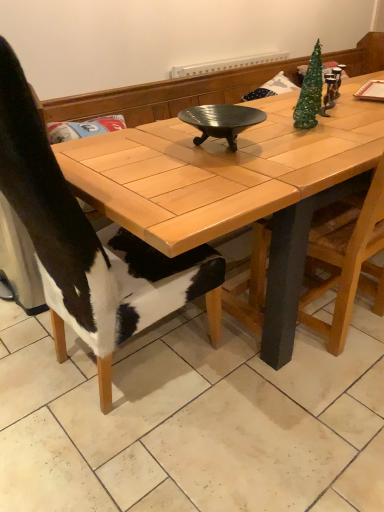
Locate an element on the screen. The height and width of the screenshot is (512, 384). spots to the right of black ribbed metal wok at center is located at coordinates (294, 146).